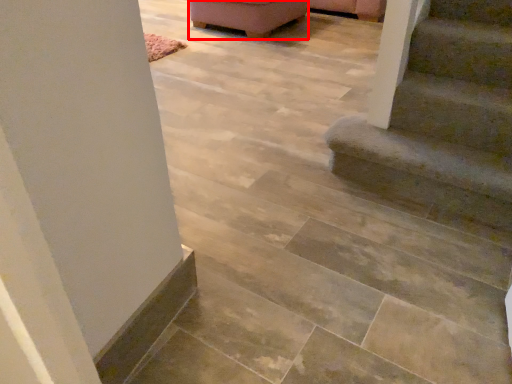
Question: Considering the relative positions of furniture (annotated by the red box) and stairs in the image provided, where is furniture (annotated by the red box) located with respect to the staircase?

Choices:
 (A) right
 (B) left

Answer: (B)